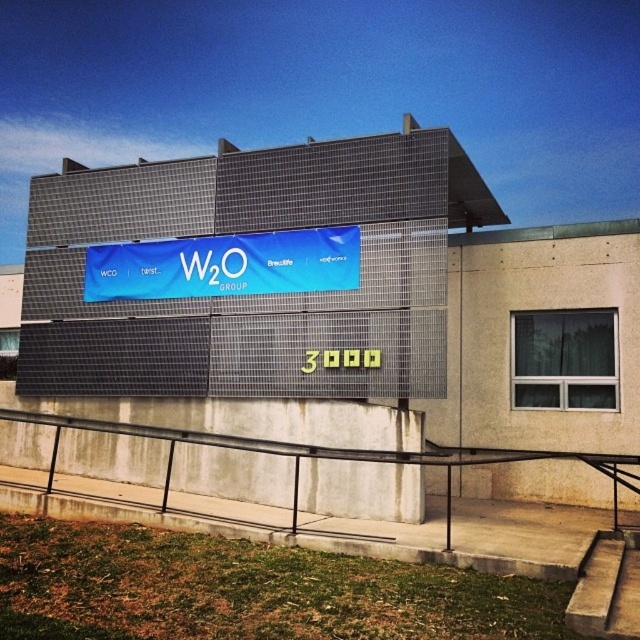
Which is below, black metal railing at lower center or blue fabric banner at center?

black metal railing at lower center is lower down.

Is black metal railing at lower center thinner than blue fabric banner at center?

Yes, black metal railing at lower center is thinner than blue fabric banner at center.

Is point (275, 515) farther from viewer compared to point (173, 288)?

No, it is not.

Where is `black metal railing at lower center`? This screenshot has height=640, width=640. black metal railing at lower center is located at coordinates (328, 509).